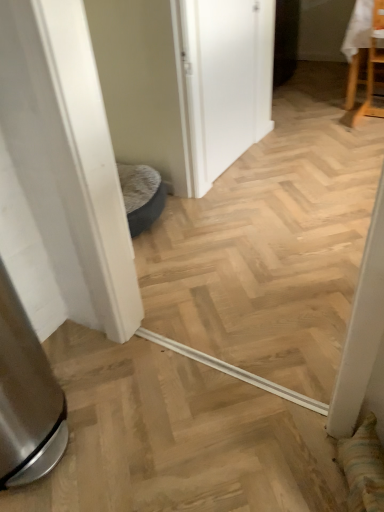
Where is `vacant space in front of white matte door at center`? Image resolution: width=384 pixels, height=512 pixels. vacant space in front of white matte door at center is located at coordinates (254, 194).